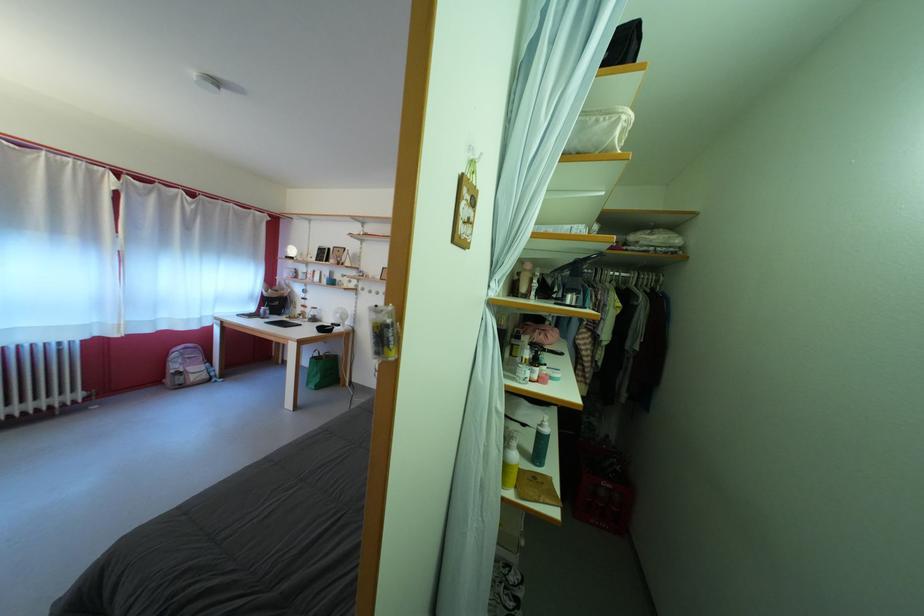
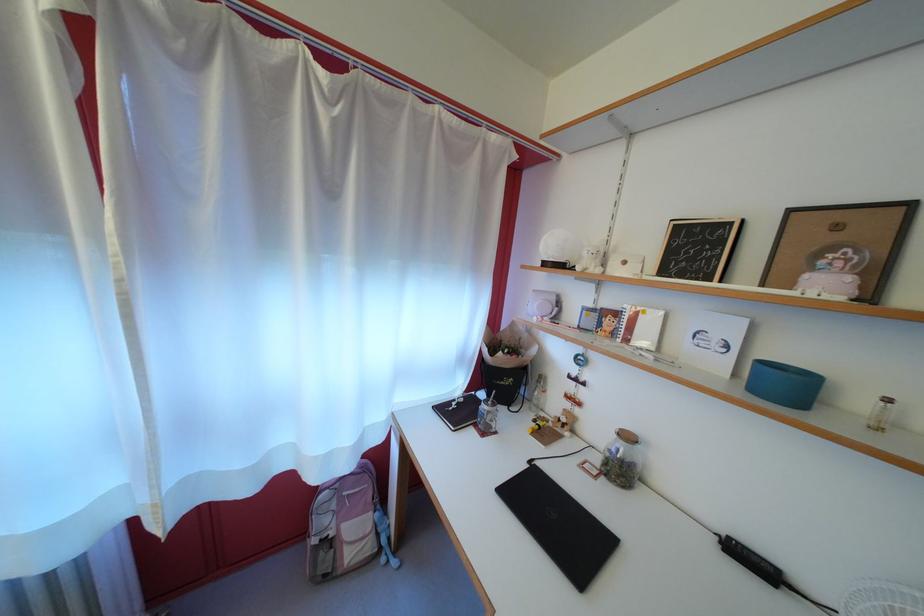
In the second image, find the point that corresponds to the point at 196,233 in the first image.

(335, 193)